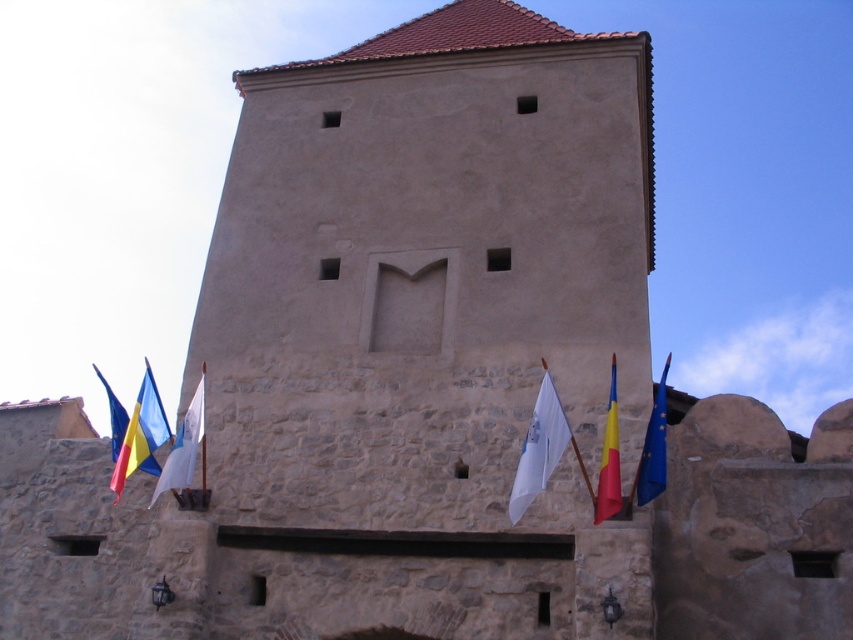
Question: Can you confirm if white fabric flag at center is positioned below red fabric flag at right?

Choices:
 (A) no
 (B) yes

Answer: (A)

Question: Among these objects, which one is farthest from the camera?

Choices:
 (A) yellow-blue fabric flag at left
 (B) blue fabric flag at right

Answer: (A)

Question: Considering the real-world distances, which object is farthest from the yellow-blue fabric flag at left?

Choices:
 (A) red fabric flag at right
 (B) white fabric flag at center
 (C) white fabric flag at lower center
 (D) blue fabric flag at right

Answer: (D)

Question: Is yellow-blue fabric flag at left to the left of white fabric flag at center from the viewer's perspective?

Choices:
 (A) yes
 (B) no

Answer: (A)

Question: Which of the following is the closest to the observer?

Choices:
 (A) (543, 484)
 (B) (183, 461)
 (C) (602, 484)

Answer: (A)

Question: Does white fabric flag at lower center appear under white fabric flag at center?

Choices:
 (A) no
 (B) yes

Answer: (A)